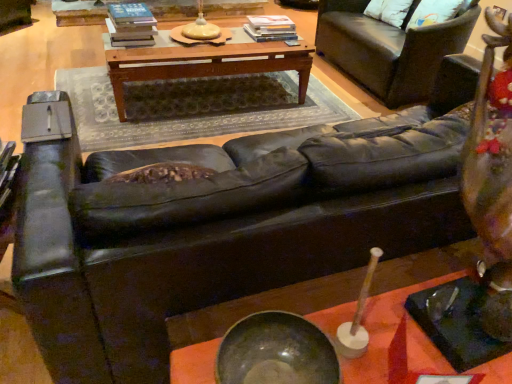
Question: From the image's perspective, relative to woodenobject at center, the first table in the top-to-bottom sequence, is metallic bowl at center, placed as the first table when sorted from front to back, above or below?

Choices:
 (A) below
 (B) above

Answer: (A)

Question: From a real-world perspective, is metallic bowl at center, the 2th table when ordered from top to bottom, above or below woodenobject at center, placed as the second table when sorted from front to back?

Choices:
 (A) above
 (B) below

Answer: (A)

Question: Based on their relative distances, which object is farther from the dark brown leather mat at center?

Choices:
 (A) black leather couch at upper right
 (B) woodenobject at center, which is the first table in back-to-front order
 (C) shiny metallic bowl at center
 (D) metallic bowl at center, placed as the 2th table when sorted from back to front
 (E) white soft pillow at upper right

Answer: (C)

Question: Which object is the farthest from the woodenobject at center, which is the first table in back-to-front order?

Choices:
 (A) metallic bowl at center, the first table ordered from the bottom
 (B) black leather couch at upper right
 (C) white soft pillow at upper right
 (D) shiny metallic bowl at center
 (E) dark brown leather mat at center

Answer: (D)